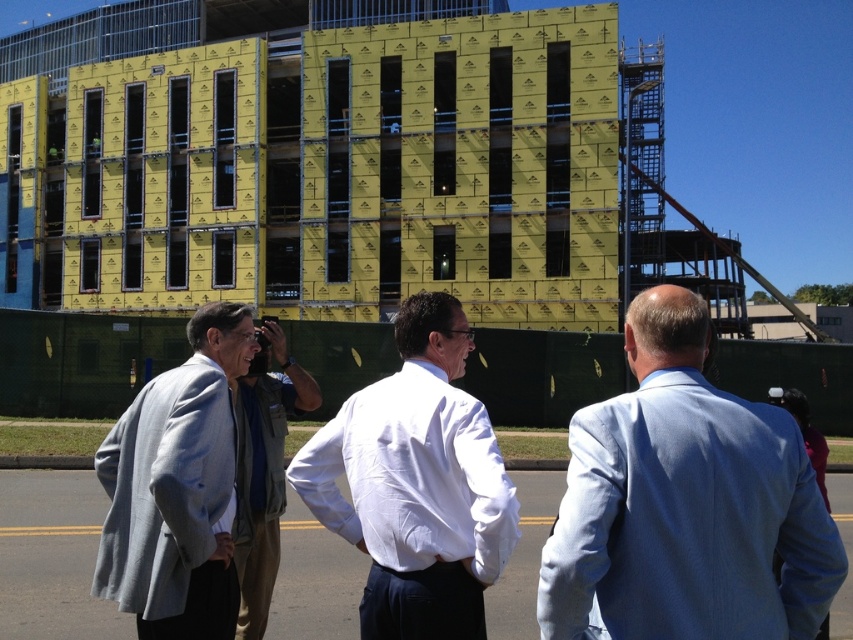
Does light blue suit at center appear under light gray fabric jacket at center?

No, light blue suit at center is not below light gray fabric jacket at center.

This screenshot has height=640, width=853. What do you see at coordinates (685, 504) in the screenshot?
I see `light blue suit at center` at bounding box center [685, 504].

Locate an element on the screen. The height and width of the screenshot is (640, 853). light blue suit at center is located at coordinates click(685, 504).

Between point (503, 545) and point (102, 582), which one is positioned in front?

Point (503, 545)

Can you confirm if white smooth shirt at center is positioned above gray woolen sweater at left?

Yes, white smooth shirt at center is above gray woolen sweater at left.

Image resolution: width=853 pixels, height=640 pixels. Find the location of `white smooth shirt at center`. white smooth shirt at center is located at coordinates point(416,483).

Consider the image. Does white smooth shirt at center appear over light gray fabric jacket at center?

Actually, white smooth shirt at center is below light gray fabric jacket at center.

Is white smooth shirt at center below light gray fabric jacket at center?

Indeed, white smooth shirt at center is positioned under light gray fabric jacket at center.

The width and height of the screenshot is (853, 640). I want to click on white smooth shirt at center, so click(x=416, y=483).